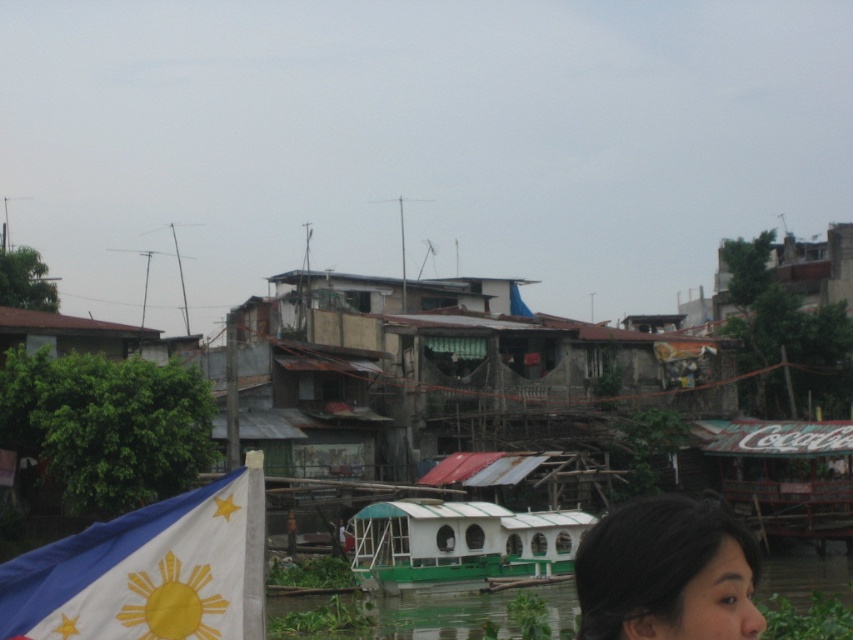
You are standing at the riverbank looking towards the houses. There are two points marked on the image. The first point is at coordinate point (x=57, y=627) and the second is at point (x=523, y=556). Which point is closer to you?

Point (x=57, y=627) is in front of point (x=523, y=556), so the first point is closer to you.

You are a photographer standing on the riverbank. You want to capture a photo of the dark brown hair at lower right and the green matte boat at center. Which object should you zoom in on to make them appear the same size in the photo?

The dark brown hair at lower right has a larger width than the green matte boat at center. To make them appear the same size in the photo, you should zoom in on the darker brown hair at lower right.

You are a visitor planning to take a photo of the white fabric flag at lower left and dark brown hair at lower right. Which object should you focus on first if you want to capture both in one frame without moving the camera?

You should focus on the white fabric flag at lower left first because it is closer to the camera than the dark brown hair at lower right, allowing both to be in the frame without moving the camera.